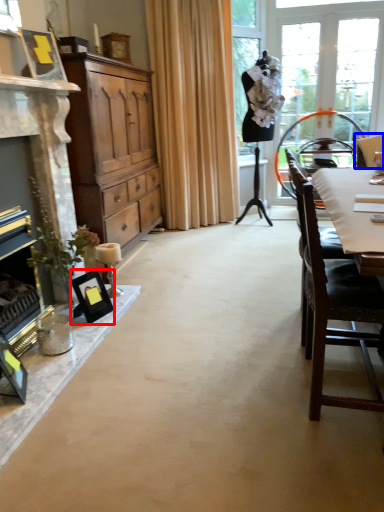
Question: Which object is further to the camera taking this photo, picture frame (highlighted by a red box) or chair (highlighted by a blue box)?

Choices:
 (A) picture frame
 (B) chair

Answer: (B)